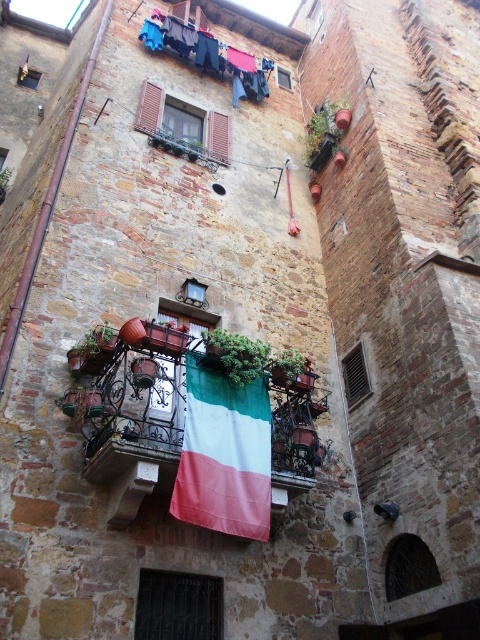
Who is lower down, red-white-green fabric flag at center or blue fabric clothesline at upper center?

Positioned lower is red-white-green fabric flag at center.

Can you confirm if red-white-green fabric flag at center is positioned to the right of blue fabric clothesline at upper center?

Correct, you'll find red-white-green fabric flag at center to the right of blue fabric clothesline at upper center.

Image resolution: width=480 pixels, height=640 pixels. What do you see at coordinates (224, 456) in the screenshot? I see `red-white-green fabric flag at center` at bounding box center [224, 456].

The image size is (480, 640). What are the coordinates of `red-white-green fabric flag at center` in the screenshot? It's located at (224, 456).